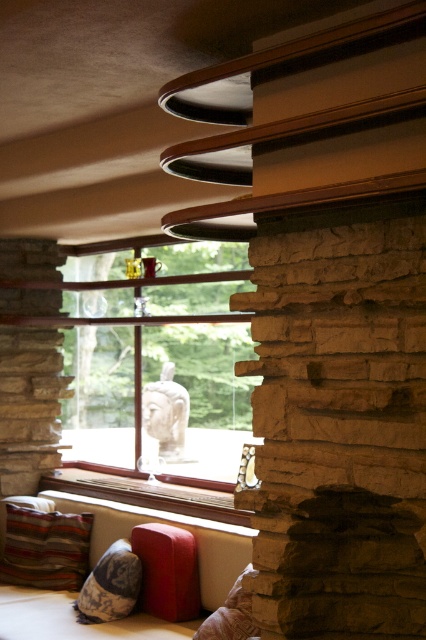
Is clear glass window at center below wooden at center?

Incorrect, clear glass window at center is not positioned below wooden at center.

Between point (187, 314) and point (138, 483), which one is positioned in front?

Point (138, 483) is more forward.

Does point (132, 499) come behind point (218, 518)?

That is True.

The width and height of the screenshot is (426, 640). I want to click on clear glass window at center, so click(x=160, y=380).

Is wooden at center above textured beige pillow at lower left?

Indeed, wooden at center is positioned over textured beige pillow at lower left.

Is wooden at center positioned at the back of textured beige pillow at lower left?

No, it is not.

What do you see at coordinates (146, 493) in the screenshot? This screenshot has width=426, height=640. I see `wooden at center` at bounding box center [146, 493].

Identify the location of wooden at center. (146, 493).

Who is higher up, textured beige pillow at lower left or velvety brown pillow at lower center?

velvety brown pillow at lower center

Does textured beige pillow at lower left have a lesser height compared to velvety brown pillow at lower center?

Incorrect, textured beige pillow at lower left's height does not fall short of velvety brown pillow at lower center's.

Image resolution: width=426 pixels, height=640 pixels. In order to click on textured beige pillow at lower left in this screenshot , I will do `click(111, 586)`.